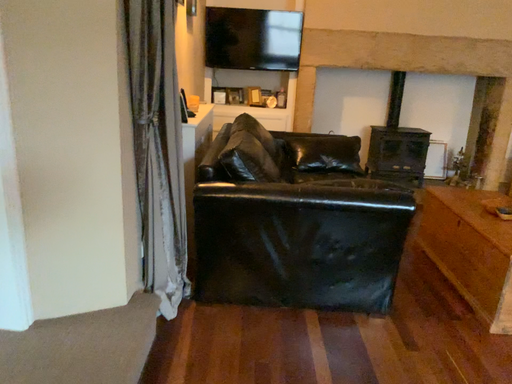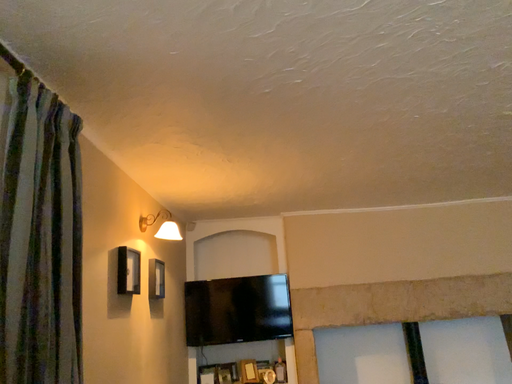
Question: How did the camera likely rotate when shooting the video?

Choices:
 (A) rotated downward
 (B) rotated upward

Answer: (B)